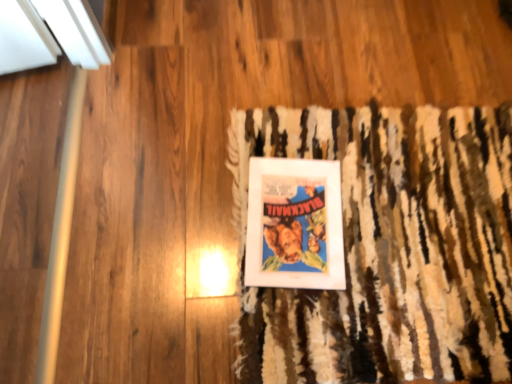
Image resolution: width=512 pixels, height=384 pixels. Identify the location of vacant space situated above matte paper poster at center (from a real-world perspective). (293, 216).